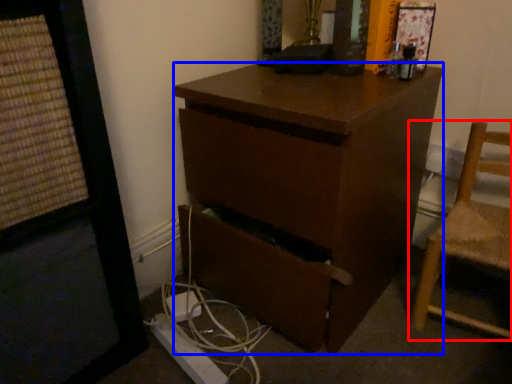
Question: Which object is closer to the camera taking this photo, chair (highlighted by a red box) or desk (highlighted by a blue box)?

Choices:
 (A) chair
 (B) desk

Answer: (B)